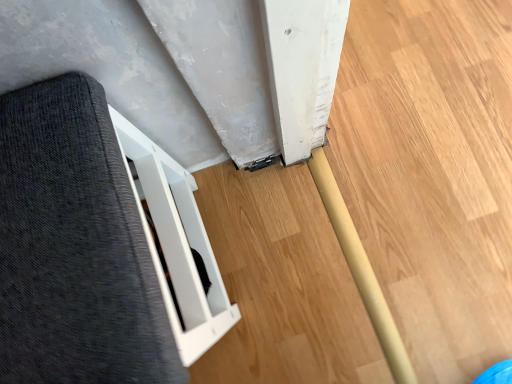
Image resolution: width=512 pixels, height=384 pixels. What are the coordinates of `white plastic drawer at lower left` in the screenshot? It's located at (97, 246).

Describe the element at coordinates (97, 246) in the screenshot. Image resolution: width=512 pixels, height=384 pixels. I see `white plastic drawer at lower left` at that location.

Identify the location of white plastic drawer at lower left. (97, 246).